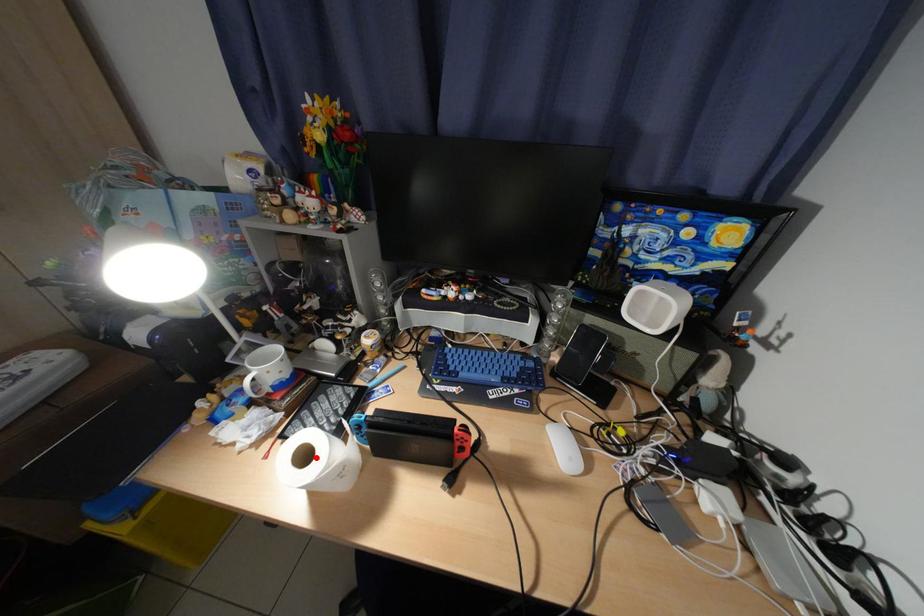
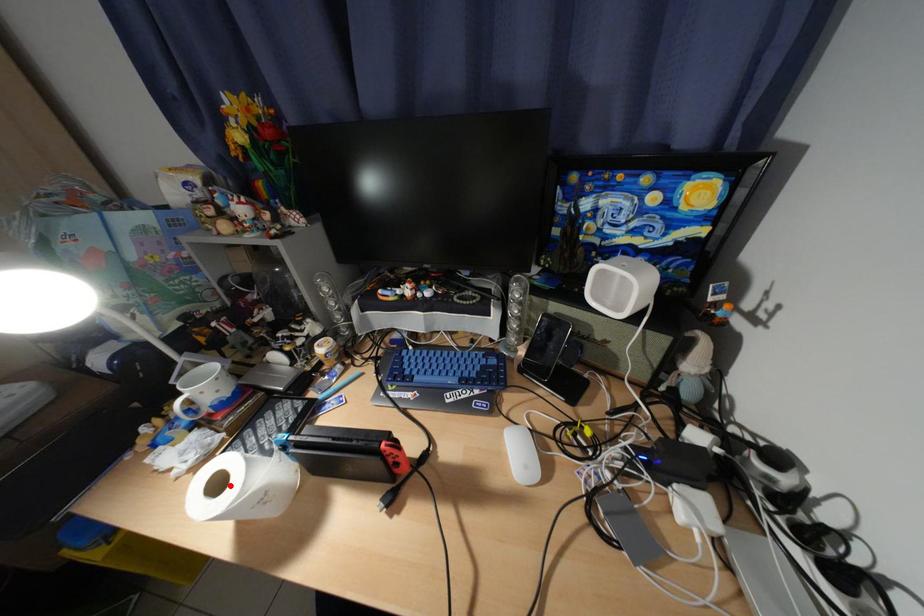
I am providing you with two images of the same scene from different viewpoints. A red point is marked on the first image and another point is marked on the second image. Is the red point in image1 aligned with the point shown in image2?

Yes